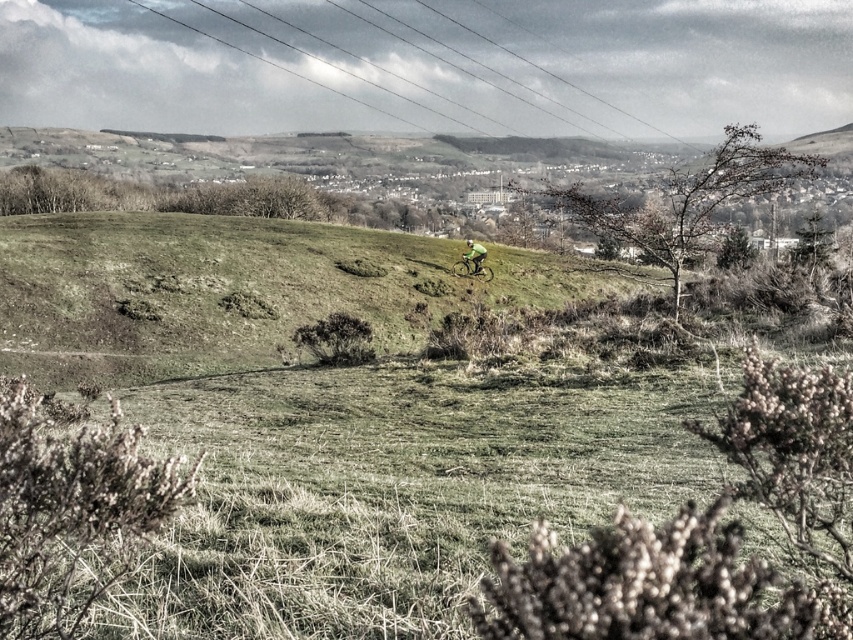
You are a delivery person who needs to place both the green matte mountain bike at center and the green fabric bicycle at center into a storage area that is 60 centimeters wide. Can both bikes fit side by side without overlapping?

The distance between the green matte mountain bike at center and the green fabric bicycle at center is 61.59 centimeters. Since the storage area is only 60 centimeters wide, the bikes cannot fit side by side without overlapping.

You are standing at the point with coordinates point [405,99] and want to move towards the cyclist in the middle ground. Is the point point [479,292] between you and the cyclist?

Yes, the point [479,292] is between you and the cyclist because it is in front of point [405,99], which is your current position.